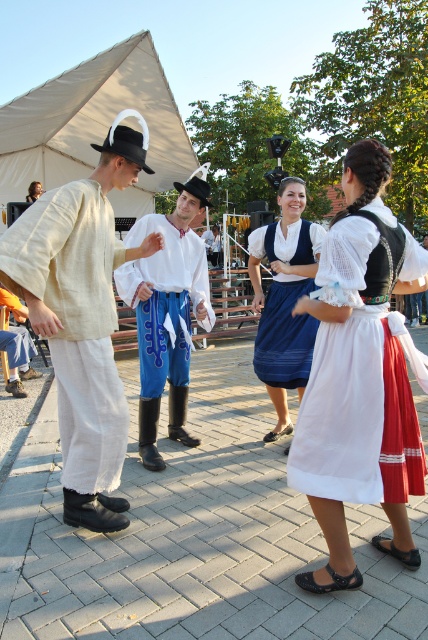
Is matte white shirt at center above smooth brown hair at upper left?

Incorrect, matte white shirt at center is not positioned above smooth brown hair at upper left.

Based on the photo, is the position of matte white shirt at center less distant than that of smooth brown hair at upper left?

Yes, it is in front of smooth brown hair at upper left.

Locate an element on the screen. This screenshot has width=428, height=640. matte white shirt at center is located at coordinates (82, 317).

Is the position of white canvas tent at upper left more distant than that of white linen shirt at center?

Yes.

Does white canvas tent at upper left have a greater height compared to white linen shirt at center?

No, white canvas tent at upper left is not taller than white linen shirt at center.

Which is in front, point (50, 77) or point (201, 189)?

Positioned in front is point (201, 189).

Where is `white canvas tent at upper left`? The image size is (428, 640). white canvas tent at upper left is located at coordinates (94, 125).

Who is more distant from viewer, (x=110, y=221) or (x=151, y=426)?

Point (x=151, y=426)

Between matte white shirt at center and white linen shirt at center, which one has less height?

white linen shirt at center is shorter.

Is point (35, 307) closer to camera compared to point (139, 308)?

Yes.

The height and width of the screenshot is (640, 428). I want to click on matte white shirt at center, so click(82, 317).